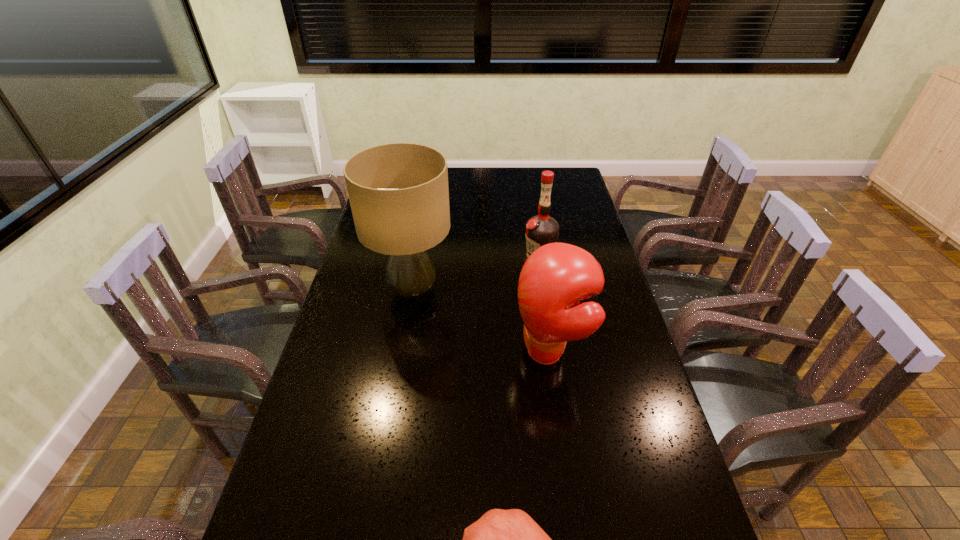
Where is `vacant region located 0.300m on the striking surface of the boxing glove`? This screenshot has width=960, height=540. vacant region located 0.300m on the striking surface of the boxing glove is located at coordinates (411, 352).

Where is `object located in the left edge section of the desktop`? object located in the left edge section of the desktop is located at coordinates (399, 196).

The image size is (960, 540). What are the coordinates of `object at the right edge` in the screenshot? It's located at (554, 279).

This screenshot has width=960, height=540. What are the coordinates of `vacant region at the far edge of the desktop` in the screenshot? It's located at (516, 176).

Where is `vacant region at the left edge of the desktop`? This screenshot has height=540, width=960. vacant region at the left edge of the desktop is located at coordinates (337, 315).

Identify the location of vacant area at the right edge of the desktop. (590, 233).

You are a GUI agent. You are given a task and a screenshot of the screen. Output one action in this format:
    pyautogui.click(x=<x>, y=<y>)
    Task: Click on the free space at the far right corner of the desktop
    
    Given the screenshot: What is the action you would take?
    [564, 181]

This screenshot has height=540, width=960. Identify the location of vacant region between the leftmost object and the third farthest object. (482, 321).

You are a GUI agent. You are given a task and a screenshot of the screen. Output one action in this format:
    pyautogui.click(x=<x>, y=<y>)
    Task: Click on the vacant point located between the boxing glove and the tallest object
    The width and height of the screenshot is (960, 540).
    Given the screenshot: What is the action you would take?
    pyautogui.click(x=482, y=321)

Point out which object is positioned as the third nearest to the boxing glove. Please provide its 2D coordinates. Your answer should be formatted as a tuple, i.e. [(x, y)], where the tuple contains the x and y coordinates of a point satisfying the conditions above.

[(501, 539)]